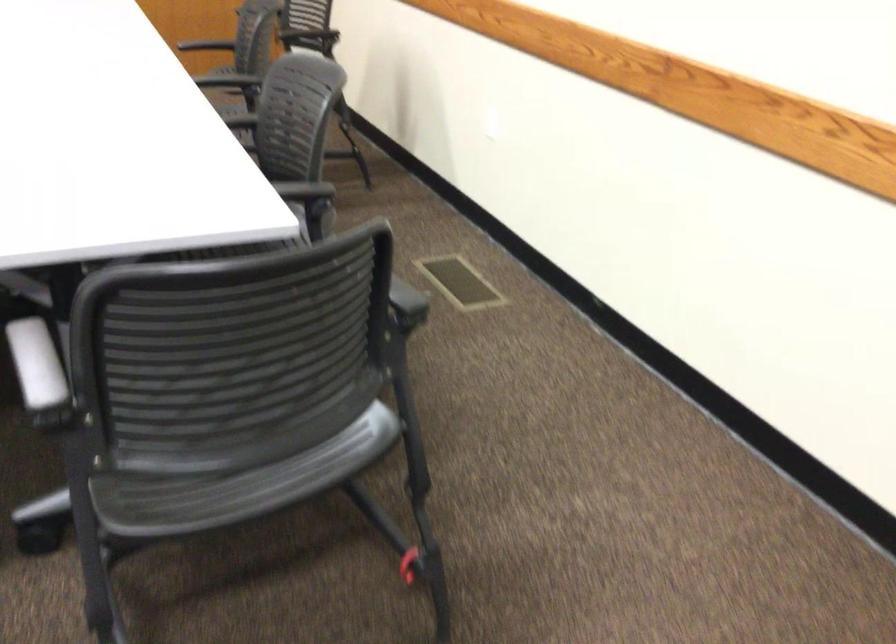
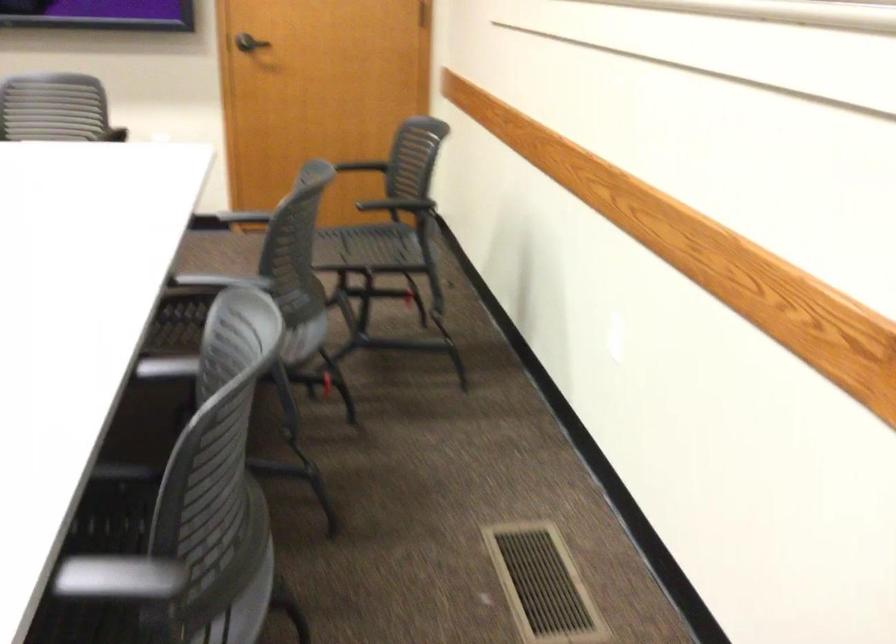
Find the pixel in the second image that matches (222,80) in the first image.

(220, 281)